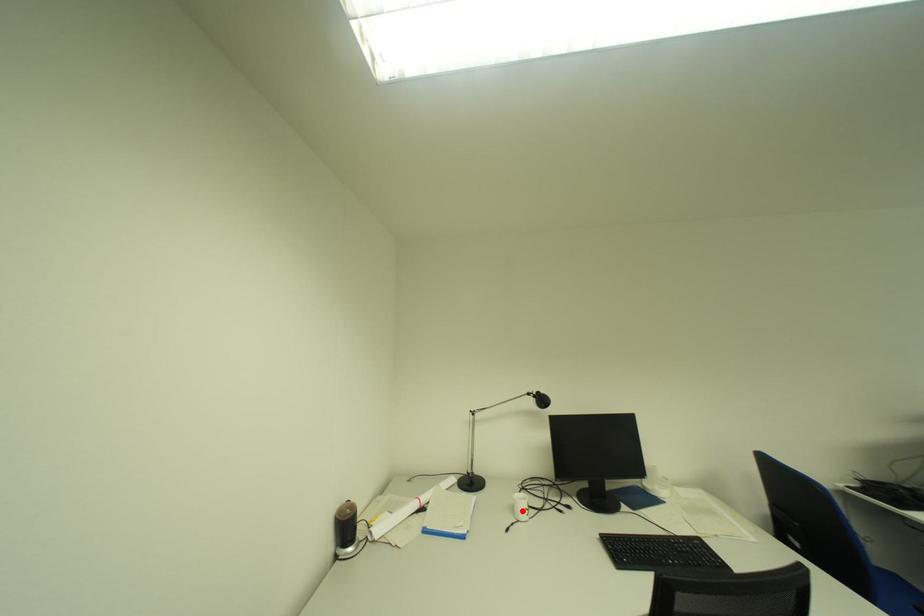
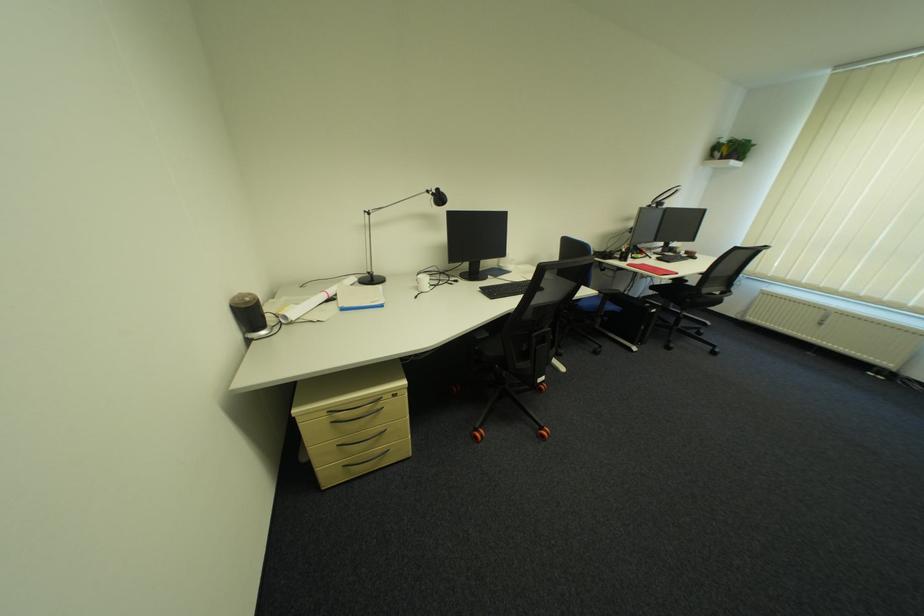
In the second image, find the point that corresponds to the highlighted location in the first image.

(427, 288)